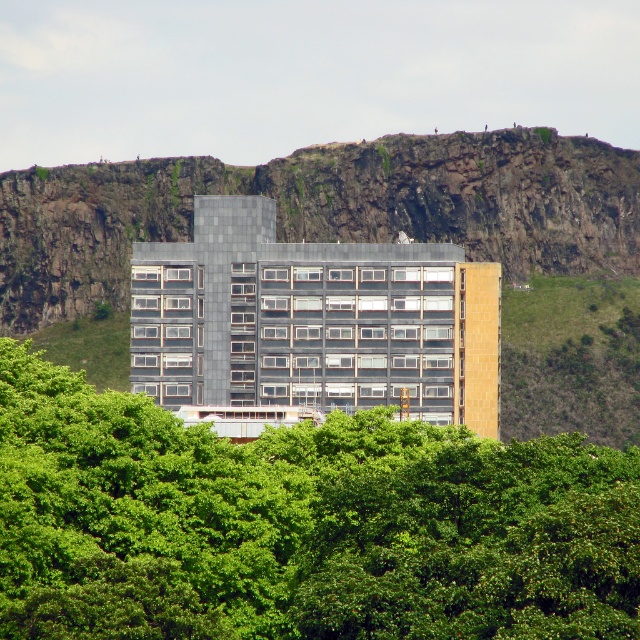
You are a landscape architect planning to add a new pathway between the green leafy tree at center and the rugged rock at center. Considering their sizes, which object might require more clearance space for the pathway?

The rugged rock at center requires more clearance space because it occupies more space than the green leafy tree at center.